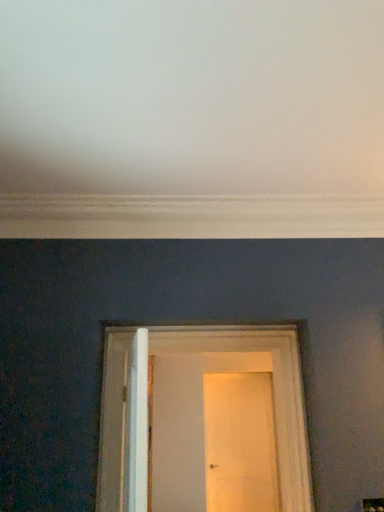
Question: Is white wooden door at center, marked as the second door in a back-to-front arrangement, wider than wooden door at center, the second door in the front-to-back sequence?

Choices:
 (A) yes
 (B) no

Answer: (A)

Question: From the image's perspective, is white wooden door at center, marked as the second door in a bottom-to-top arrangement, below wooden door at center, placed as the 1th door when sorted from back to front?

Choices:
 (A) no
 (B) yes

Answer: (A)

Question: Is white wooden door at center, acting as the first door starting from the top, not within wooden door at center, placed as the 1th door when sorted from back to front?

Choices:
 (A) yes
 (B) no

Answer: (A)

Question: Could you tell me if white wooden door at center, marked as the second door in a back-to-front arrangement, is facing wooden door at center, arranged as the first door when ordered from the bottom?

Choices:
 (A) yes
 (B) no

Answer: (B)

Question: Does white wooden door at center, marked as the second door in a back-to-front arrangement, contain wooden door at center, which is the second door in top-to-bottom order?

Choices:
 (A) no
 (B) yes

Answer: (A)

Question: Considering the relative sizes of white wooden door at center, acting as the first door starting from the top, and wooden door at center, the second door in the front-to-back sequence, in the image provided, is white wooden door at center, acting as the first door starting from the top, bigger than wooden door at center, the second door in the front-to-back sequence,?

Choices:
 (A) no
 (B) yes

Answer: (B)

Question: Considering the relative sizes of wooden door at center, placed as the 1th door when sorted from back to front, and white wooden door at center, marked as the second door in a back-to-front arrangement, in the image provided, is wooden door at center, placed as the 1th door when sorted from back to front, taller than white wooden door at center, marked as the second door in a back-to-front arrangement,?

Choices:
 (A) no
 (B) yes

Answer: (B)

Question: Is wooden door at center, which is the second door in top-to-bottom order, aimed at white wooden door at center, placed as the 1th door when sorted from front to back?

Choices:
 (A) yes
 (B) no

Answer: (A)

Question: Are wooden door at center, the second door in the front-to-back sequence, and white wooden door at center, acting as the first door starting from the top, far apart?

Choices:
 (A) no
 (B) yes

Answer: (B)

Question: Does wooden door at center, which is the second door in top-to-bottom order, have a smaller size compared to white wooden door at center, placed as the 1th door when sorted from front to back?

Choices:
 (A) no
 (B) yes

Answer: (B)

Question: Is wooden door at center, the second door in the front-to-back sequence, not inside white wooden door at center, placed as the 1th door when sorted from front to back?

Choices:
 (A) no
 (B) yes

Answer: (B)

Question: Can you confirm if wooden door at center, which is the second door in top-to-bottom order, is positioned to the left of white wooden door at center, placed as the 1th door when sorted from front to back?

Choices:
 (A) no
 (B) yes

Answer: (A)

Question: Is white wooden door at center, acting as the first door starting from the top, spatially inside wooden door at center, the second door in the front-to-back sequence, or outside of it?

Choices:
 (A) outside
 (B) inside

Answer: (A)